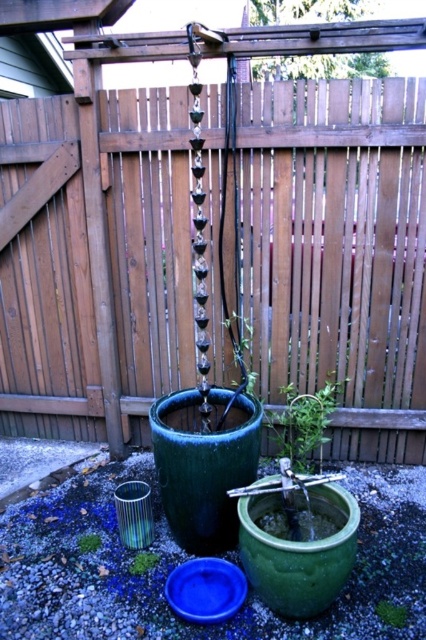
You are designing a garden layout and want to place a decorative item between the wooden fence at center and the green matte plant at center. Which object should the item be placed closer to if you want it to be equidistant from both?

To place the item equidistant from both the wooden fence at center and the green matte plant at center, you should position it closer to the green matte plant at center since the wooden fence at center might be wider and thus requires more space between them for equal distance.

You are planning to place a small decorative item on the wooden fence at center and the green matte plant at center. Which surface can accommodate a larger item?

The wooden fence at center is larger in size than the green matte plant at center, so the wooden fence at center can accommodate a larger item.

You are standing in the garden looking at the rain chain. You notice two green matte plants. Which one is closer to you, the green matte plant at center or the green matte plant at lower center?

The green matte plant at center is closer to you because the green matte plant at lower center is behind it.